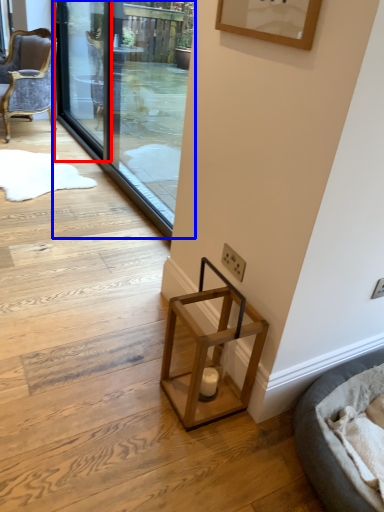
Question: Which object appears farthest to the camera in this image, screen door (highlighted by a red box) or screen door (highlighted by a blue box)?

Choices:
 (A) screen door
 (B) screen door

Answer: (A)